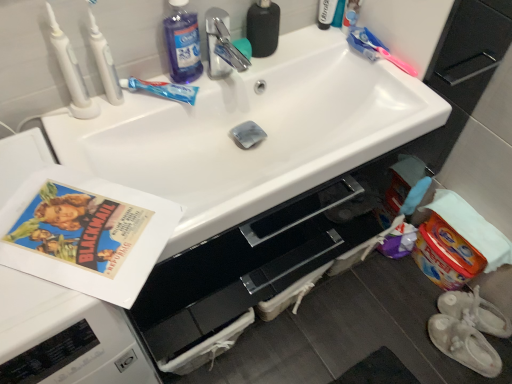
Identify the location of empty space that is in between white plastic tube at upper right and pink plastic toothbrush at upper right, the 1th toothbrush viewed from the right. (360, 56).